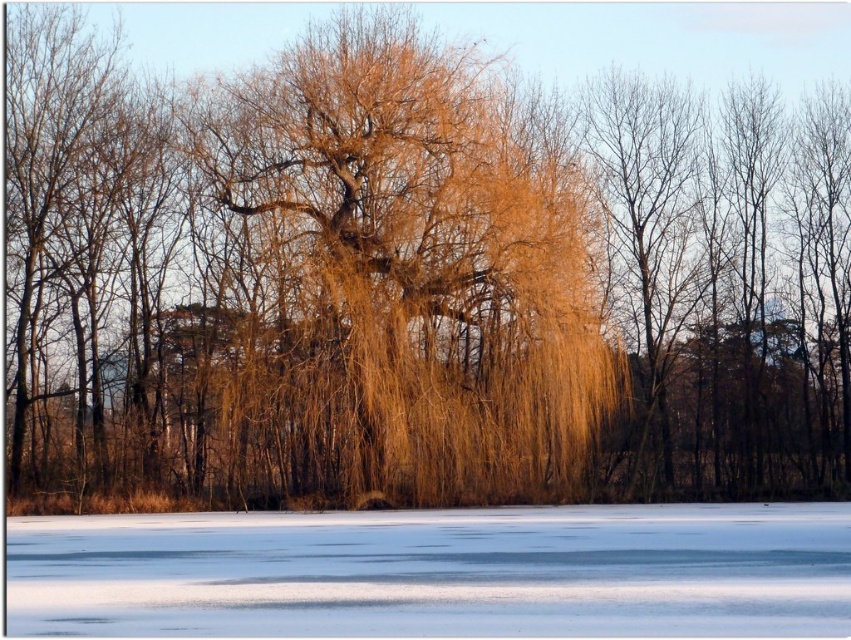
Who is more distant from viewer, (481, 269) or (311, 564)?

The point (481, 269) is behind.

Find the location of a particular element. golden textured willow at center is located at coordinates (403, 278).